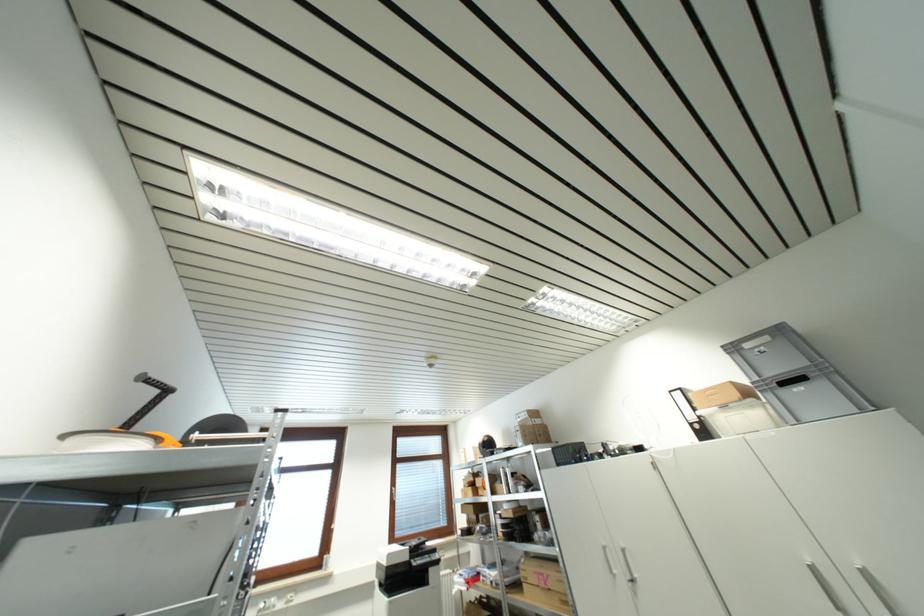
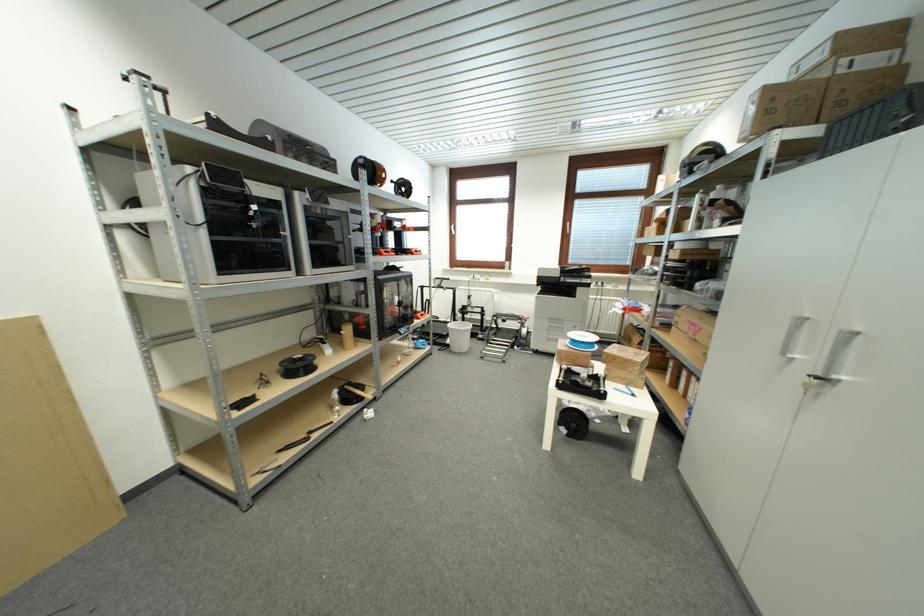
Locate, in the second image, the point that corresponds to point 543,438 in the first image.

(845, 106)